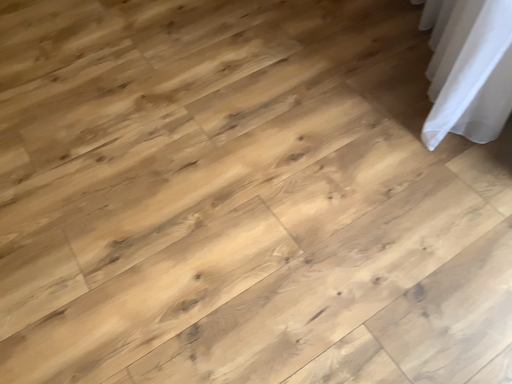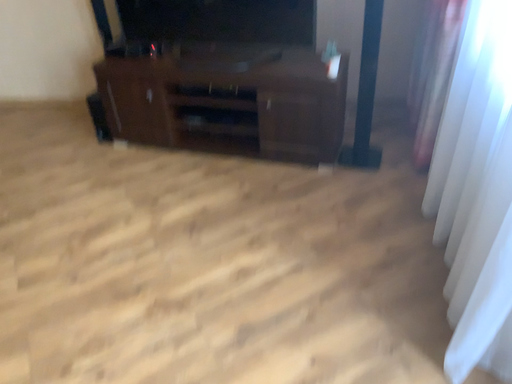
Question: How did the camera likely rotate when shooting the video?

Choices:
 (A) rotated upward
 (B) rotated downward

Answer: (A)